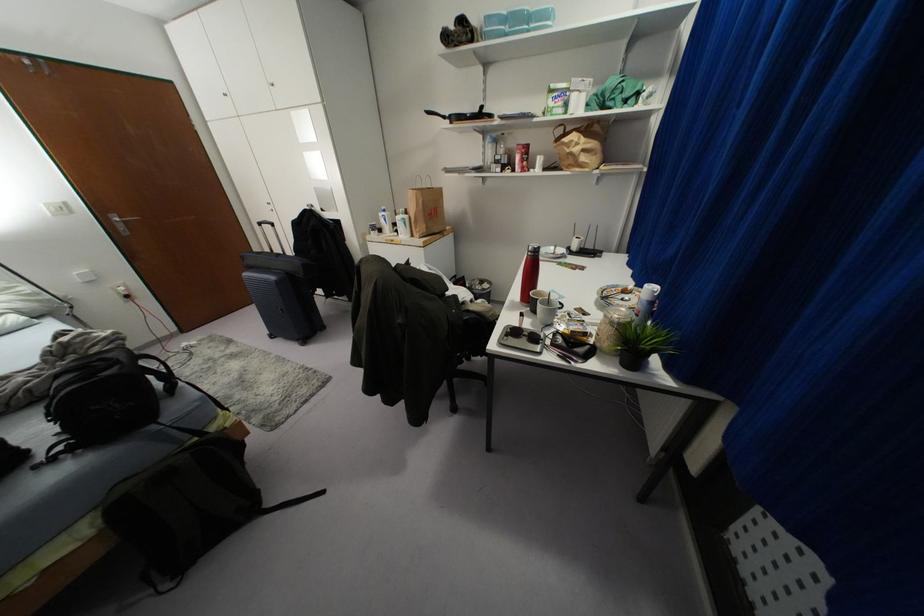
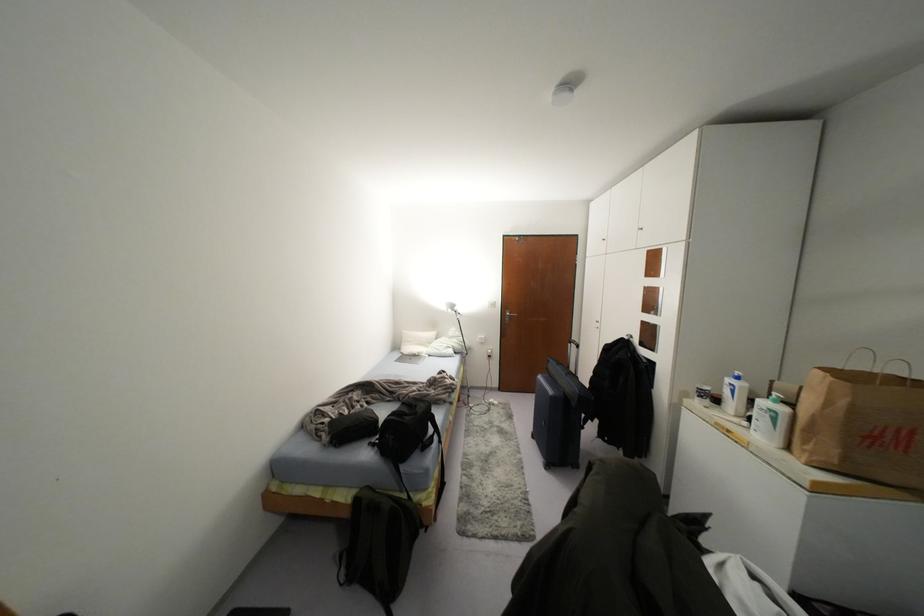
Question: The camera is either moving clockwise (left) or counter-clockwise (right) around the object. The first image is from the beginning of the video and the second image is from the end. Is the camera moving left or right when shooting the video?

Choices:
 (A) Left
 (B) Right

Answer: (B)